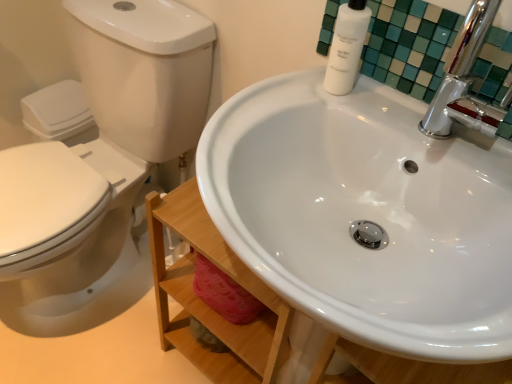
What are the coordinates of `vacant space to the left of white matte bottle at upper right` in the screenshot? It's located at (276, 96).